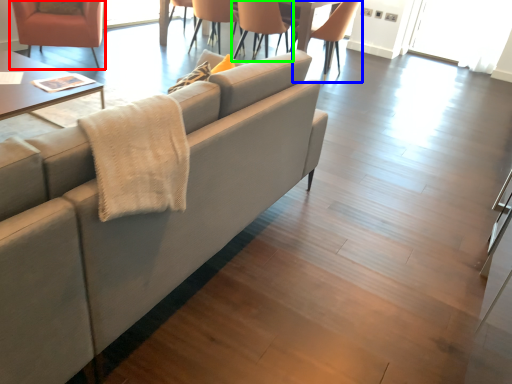
Question: Which is nearer to the chair (highlighted by a red box)? chair (highlighted by a blue box) or chair (highlighted by a green box).

Choices:
 (A) chair
 (B) chair

Answer: (B)